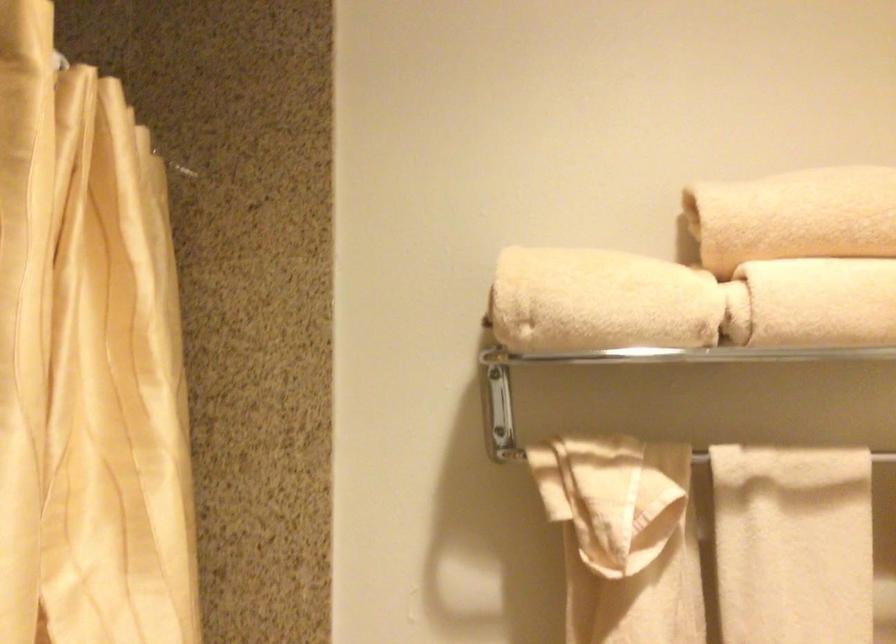
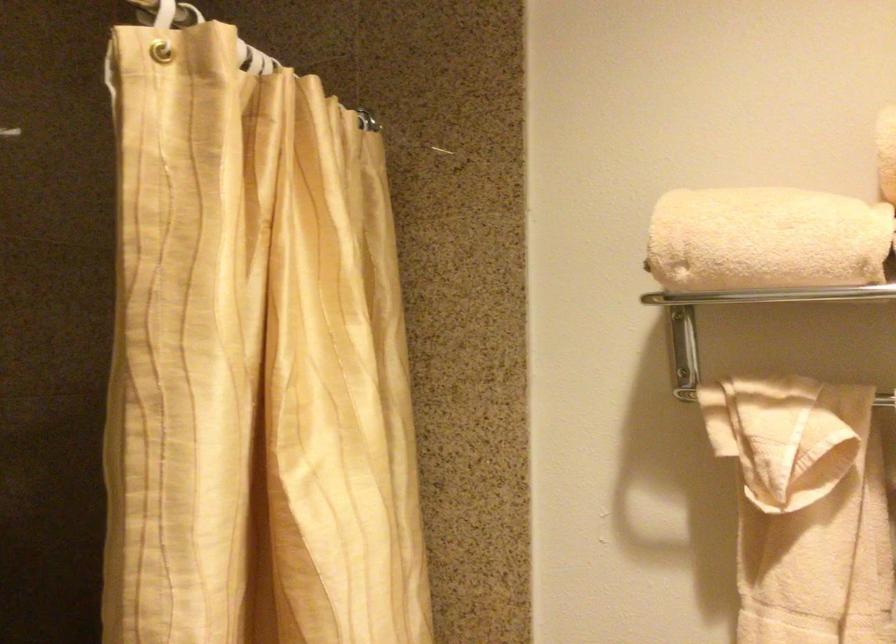
In the second image, find the point that corresponds to the point at 627,545 in the first image.

(793, 486)